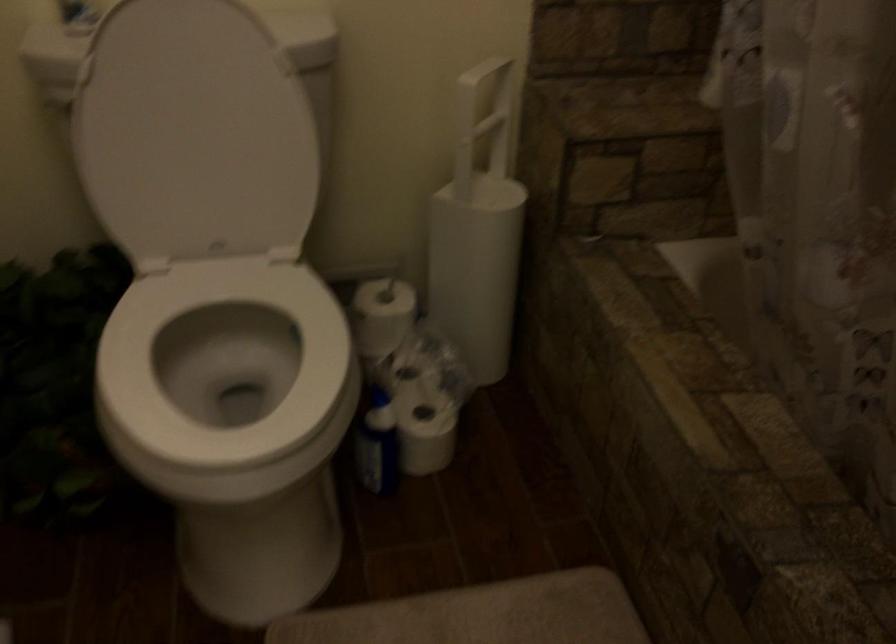
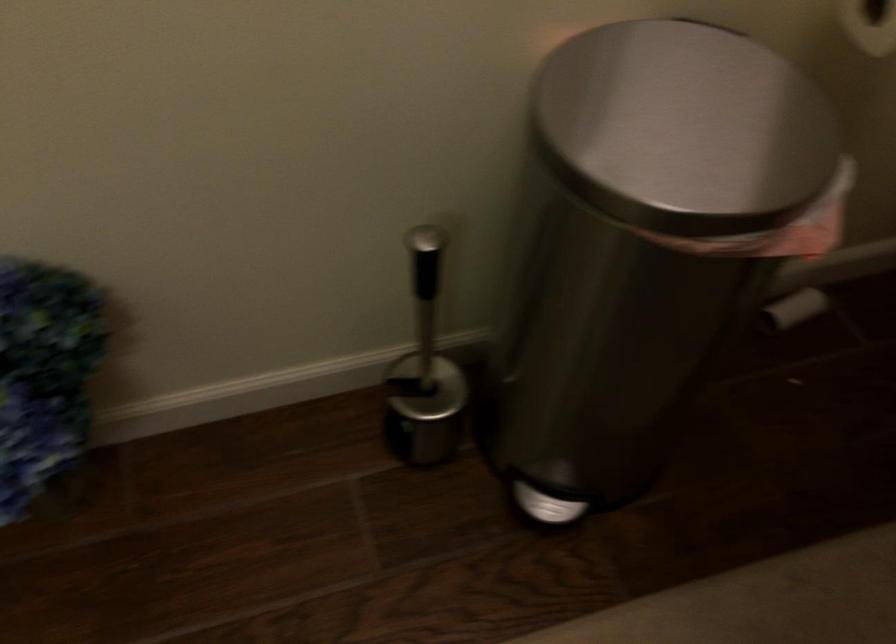
Consider the image. The first image is from the beginning of the video and the second image is from the end. How did the camera likely rotate when shooting the video?

The camera's rotation is toward left-down.